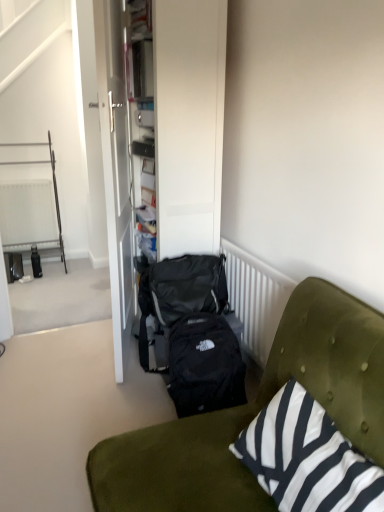
Question: From the image's perspective, is black fabric backpack at center, positioned as the 1th backpack in bottom-to-top order, above or below black fabric backpack at center, which is the 2th backpack from bottom to top?

Choices:
 (A) above
 (B) below

Answer: (B)

Question: In terms of size, does black fabric backpack at center, positioned as the 1th backpack in bottom-to-top order, appear bigger or smaller than black fabric backpack at center, which is the 2th backpack from bottom to top?

Choices:
 (A) small
 (B) big

Answer: (B)

Question: Which of these objects is positioned farthest from the white textured radiator at center, marked as the second radiator in a back-to-front arrangement?

Choices:
 (A) white textured radiator at left, the second radiator viewed from the right
 (B) velvet green couch at lower right
 (C) matte black bottle at left
 (D) metal/textured rack at left
 (E) black fabric backpack at center, positioned as the 1th backpack in bottom-to-top order

Answer: (D)

Question: Considering the real-world distances, which object is closest to the black fabric backpack at center, which is the 2th backpack from bottom to top?

Choices:
 (A) white glossy door at center
 (B) matte black suitcase at center
 (C) black and white striped cushion at lower right
 (D) black fabric backpack at center, positioned as the 1th backpack in bottom-to-top order
 (E) metal/textured rack at left

Answer: (D)